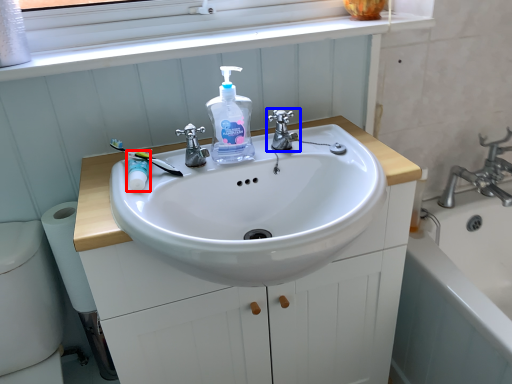
Question: Which object appears farthest to the camera in this image, mouthwash (highlighted by a red box) or tap (highlighted by a blue box)?

Choices:
 (A) mouthwash
 (B) tap

Answer: (B)